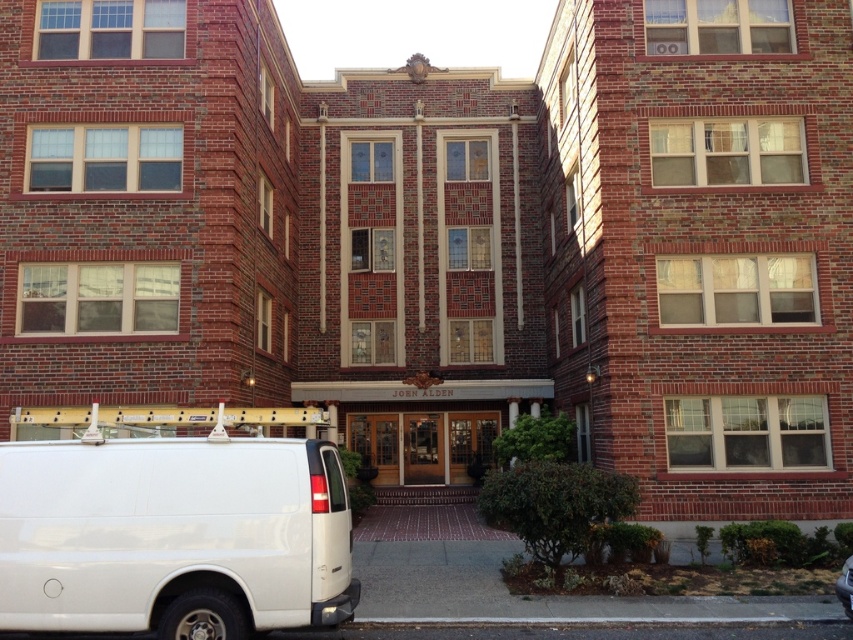
Question: Where is white matte van at lower left located in relation to shiny black car at lower right in the image?

Choices:
 (A) below
 (B) above

Answer: (B)

Question: Does white matte van at lower left come behind shiny black car at lower right?

Choices:
 (A) yes
 (B) no

Answer: (B)

Question: In this image, where is white matte van at lower left located relative to shiny black car at lower right?

Choices:
 (A) right
 (B) left

Answer: (B)

Question: Which point is closer to the camera taking this photo?

Choices:
 (A) (849, 616)
 (B) (323, 552)

Answer: (B)